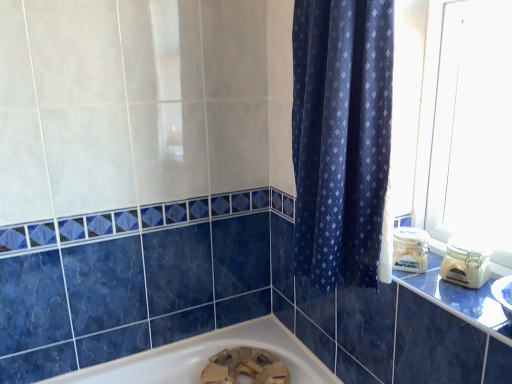
Question: Visually, is black glossy counter top at right positioned to the left or to the right of dark blue fabric curtain at center?

Choices:
 (A) left
 (B) right

Answer: (B)

Question: Looking at their shapes, would you say black glossy counter top at right is wider or thinner than dark blue fabric curtain at center?

Choices:
 (A) wide
 (B) thin

Answer: (A)

Question: Looking at the image, does black glossy counter top at right seem bigger or smaller compared to dark blue fabric curtain at center?

Choices:
 (A) small
 (B) big

Answer: (A)

Question: From their relative heights in the image, would you say dark blue fabric curtain at center is taller or shorter than black glossy counter top at right?

Choices:
 (A) short
 (B) tall

Answer: (B)

Question: Looking at their shapes, would you say dark blue fabric curtain at center is wider or thinner than black glossy counter top at right?

Choices:
 (A) thin
 (B) wide

Answer: (A)

Question: Looking at the image, does dark blue fabric curtain at center seem bigger or smaller compared to black glossy counter top at right?

Choices:
 (A) small
 (B) big

Answer: (B)

Question: From a real-world perspective, is dark blue fabric curtain at center positioned above or below black glossy counter top at right?

Choices:
 (A) below
 (B) above

Answer: (B)